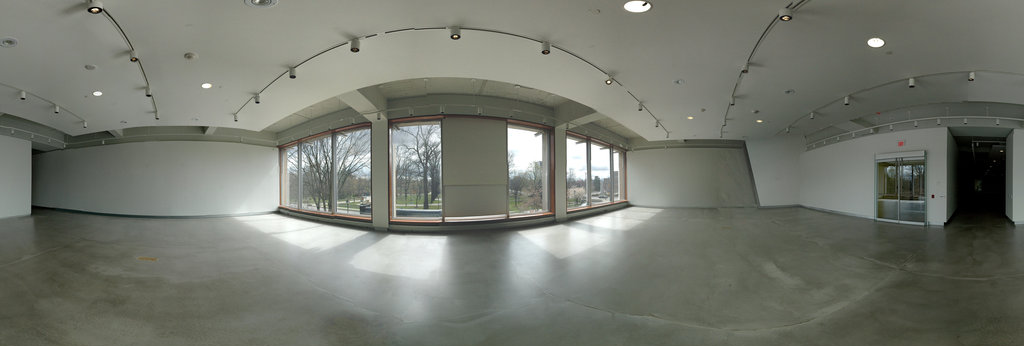
Image resolution: width=1024 pixels, height=346 pixels. Identify the location of wall to right of widows. (687, 172).